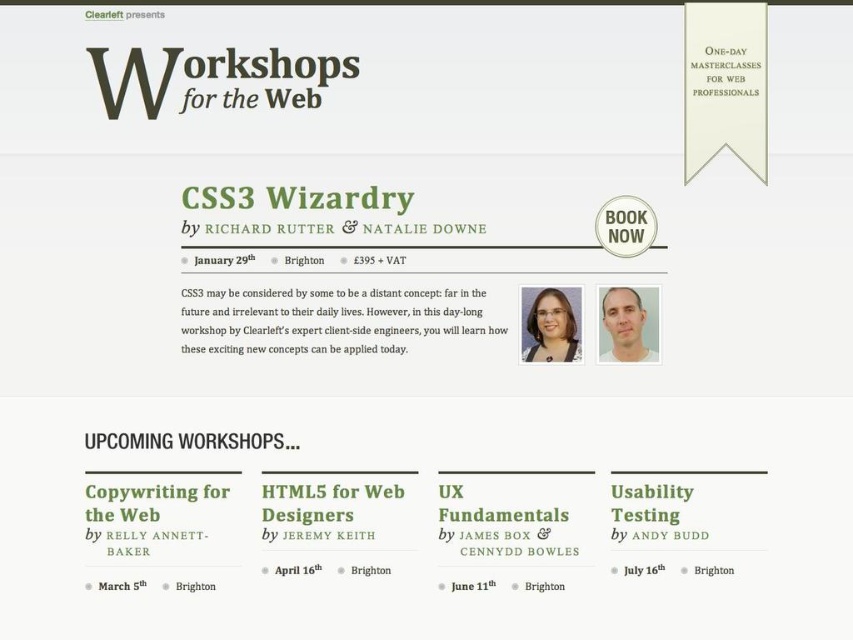
You are designing a poster for Clearleft and need to ensure that the black paper text at center and the green paper at center are arranged properly. According to the design guidelines, the taller element should be placed above the shorter one. Which element should be positioned above the other?

The black paper text at center is taller than the green paper at center, so the black paper text at center should be placed above the green paper at center to follow the design guidelines.

You are designing a promotional poster for Clearleft and need to place both the greentextured paperdate at center and the green paper at center side by side. Which one should you place on the left to ensure they fit properly?

The greentextured paperdate at center has a lesser width compared to green paper at center, so placing the narrower one on the left would allow both to fit side by side without overlapping.

You are designing a poster for the workshop and need to ensure the black text at center and green paper at center are both visible. Given their sizes, which one should you place first to avoid overlap?

The black text at center has a larger width than the green paper at center, so you should place the black text at center first to ensure it doesn not get covered by the smaller green paper at center.